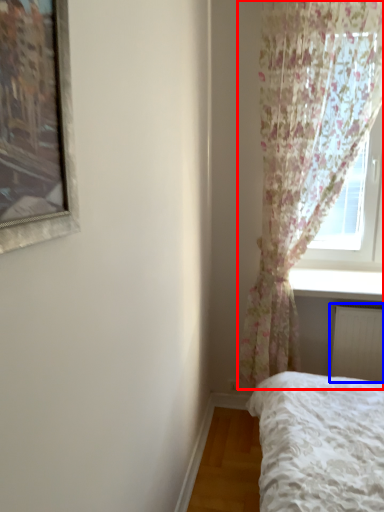
Question: Which point is closer to the camera, curtain (highlighted by a red box) or radiator (highlighted by a blue box)?

Choices:
 (A) curtain
 (B) radiator

Answer: (A)